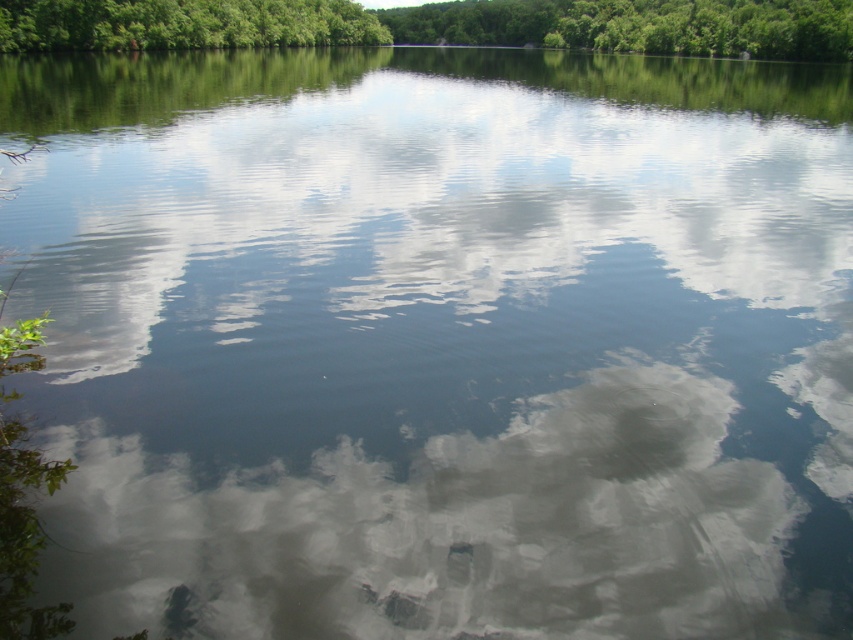
Question: Can you confirm if cloudy sky at center is bigger than green leafy trees at upper center?

Choices:
 (A) no
 (B) yes

Answer: (A)

Question: Which of the following is the farthest from the observer?

Choices:
 (A) green leafy trees at upper center
 (B) cloudy sky at center
 (C) green leafy tree at upper center

Answer: (C)

Question: Does cloudy sky at center appear on the left side of green leafy tree at upper center?

Choices:
 (A) no
 (B) yes

Answer: (B)

Question: From the image, what is the correct spatial relationship of green leafy tree at upper center in relation to green leafy trees at upper center?

Choices:
 (A) left
 (B) right

Answer: (B)

Question: Which point is farther to the camera?

Choices:
 (A) cloudy sky at center
 (B) green leafy tree at upper center

Answer: (B)

Question: Estimate the real-world distances between objects in this image. Which object is closer to the green leafy trees at upper center?

Choices:
 (A) green leafy tree at upper center
 (B) cloudy sky at center

Answer: (A)